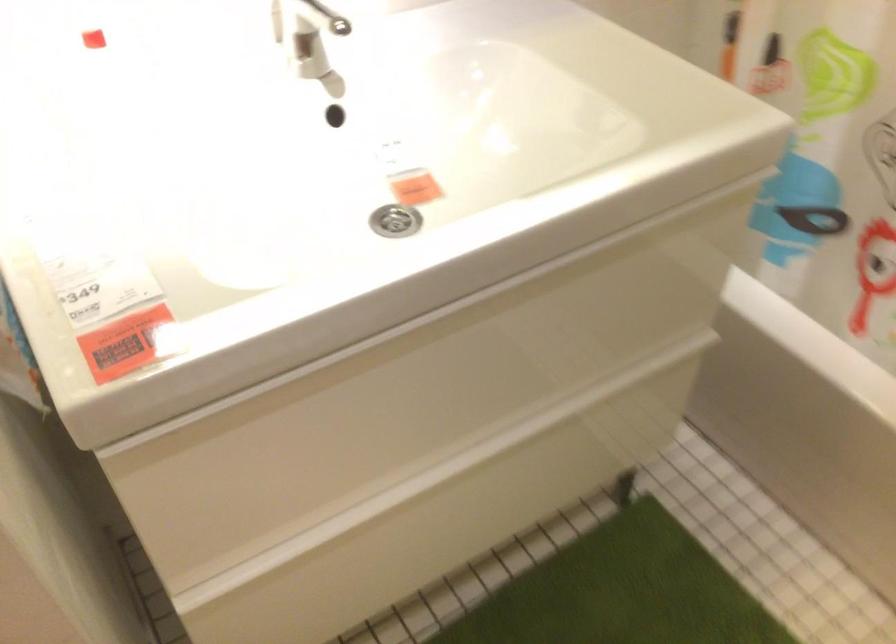
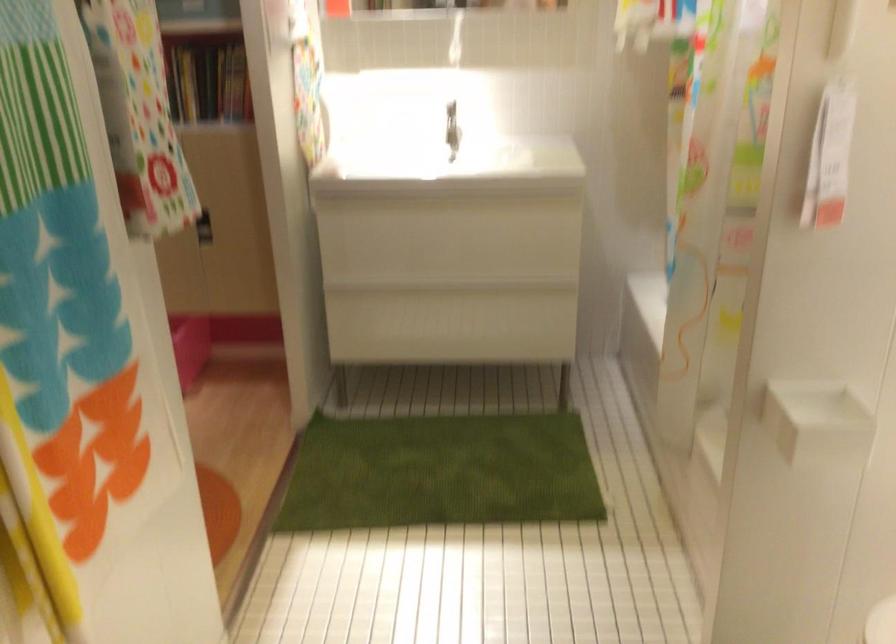
Find the pixel in the second image that matches [474,303] in the first image.

(440, 201)